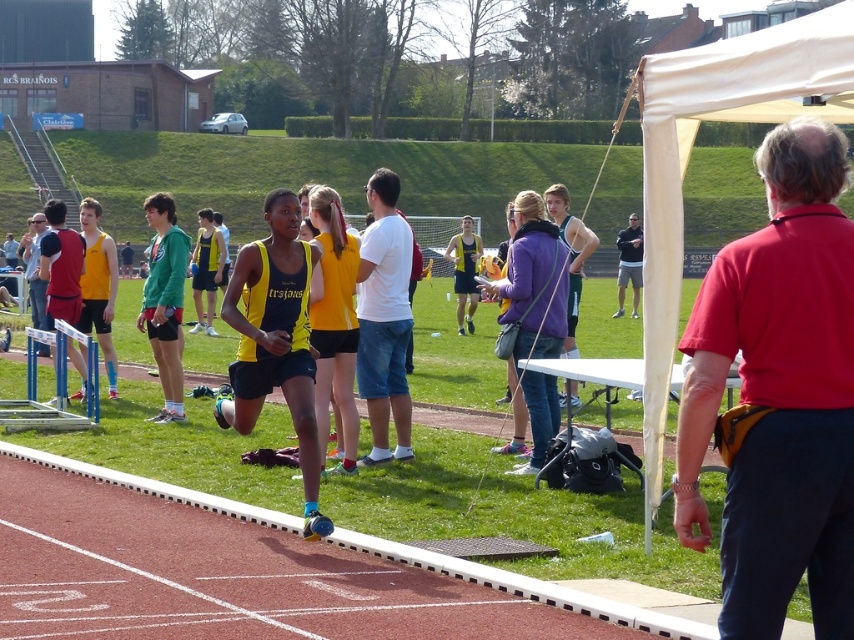
Question: Which of the following is the farthest from the observer?

Choices:
 (A) white cotton t-shirt at center
 (B) green fabric shorts at left
 (C) yellow athletic uniform at center
 (D) yellow matte running suit at center

Answer: (C)

Question: Based on their relative distances, which object is farther from the yellow matte singlet at center?

Choices:
 (A) metallic silver hurdle at lower left
 (B) yellow athletic uniform at center

Answer: (B)

Question: Does red smooth shirt at right come in front of yellow matte running suit at center?

Choices:
 (A) yes
 (B) no

Answer: (A)

Question: Can you confirm if yellow fabric shorts at center is positioned to the left of yellow matte singlet at center?

Choices:
 (A) no
 (B) yes

Answer: (A)

Question: Does yellow matte singlet at center come in front of matte yellow shorts at center?

Choices:
 (A) yes
 (B) no

Answer: (B)

Question: Which of the following is the closest to the observer?

Choices:
 (A) yellow athletic uniform at center
 (B) green athletic uniform at center

Answer: (B)